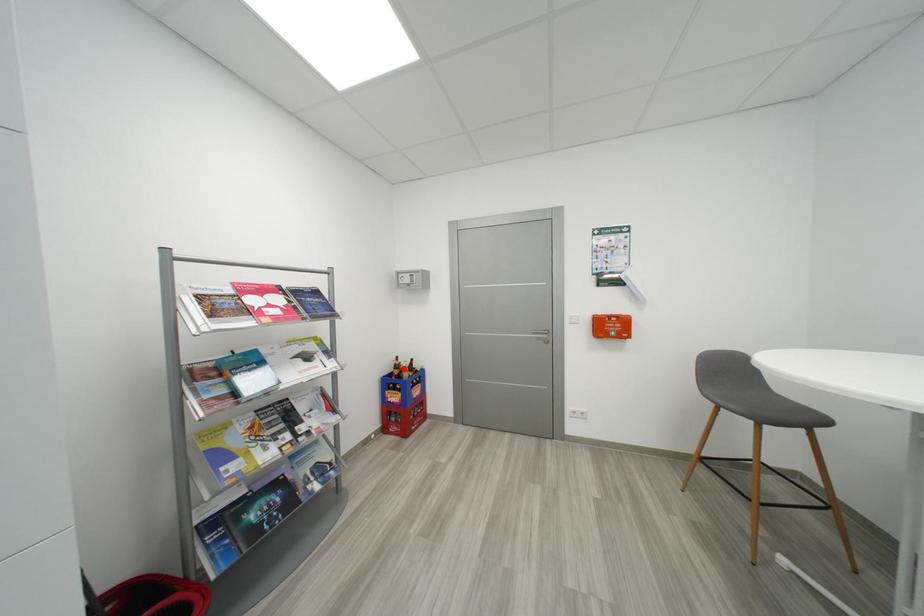
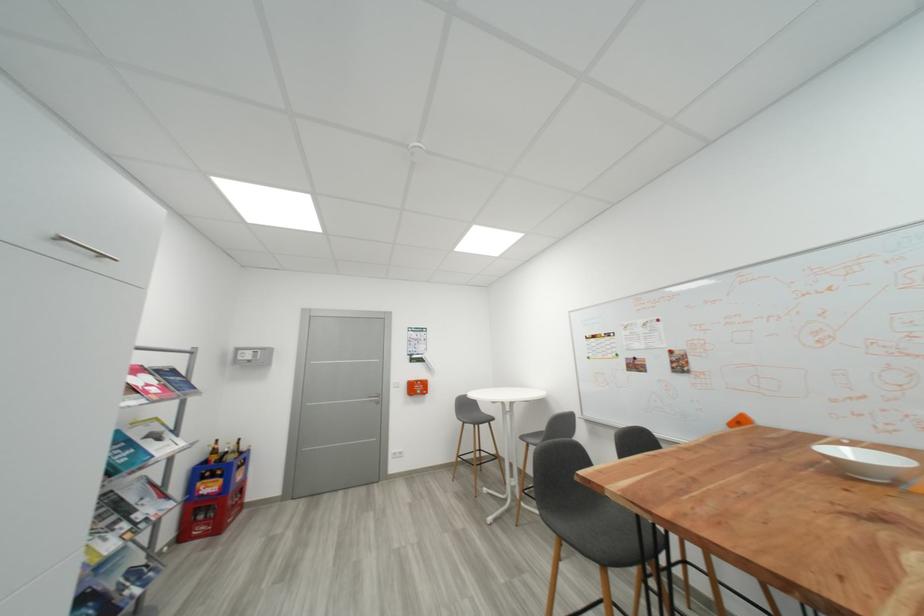
Question: I am providing you with two images of the same scene from different viewpoints. A red point is marked on the first image. Is the red point's position out of view in image 2?

Choices:
 (A) Yes
 (B) No

Answer: (B)